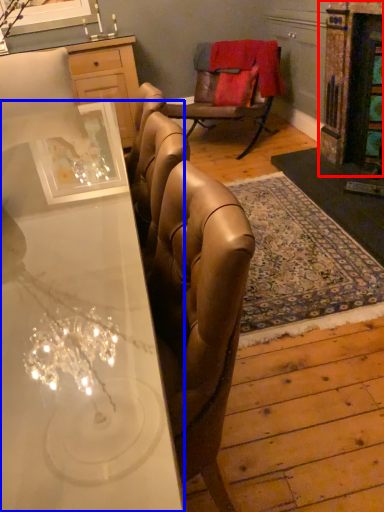
Question: Among these objects, which one is farthest to the camera, fireplace (highlighted by a red box) or desk (highlighted by a blue box)?

Choices:
 (A) fireplace
 (B) desk

Answer: (A)